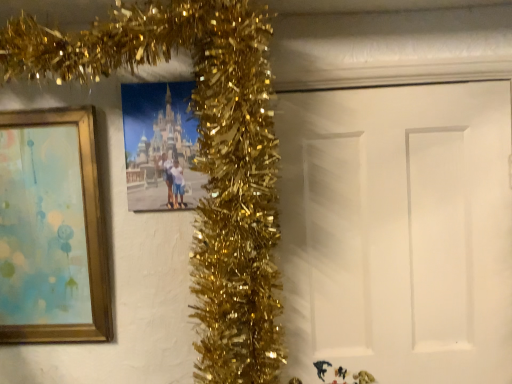
Looking at this image, how much space does matte plastic photo frame at center, positioned as the second picture frame in left-to-right order, occupy vertically?

The height of matte plastic photo frame at center, positioned as the second picture frame in left-to-right order, is 12.64 inches.

This screenshot has width=512, height=384. Describe the element at coordinates (397, 232) in the screenshot. I see `white matte door at center` at that location.

Identify the location of matte plastic photo frame at center, which is the 1th picture frame from right to left. point(159,144).

Considering the positions of points (341, 273) and (150, 137), is point (341, 273) closer to camera compared to point (150, 137)?

No, (341, 273) is behind (150, 137).

In the image, is white matte door at center positioned in front of or behind matte plastic photo frame at center, positioned as the second picture frame in left-to-right order?

white matte door at center is positioned farther from the viewer than matte plastic photo frame at center, positioned as the second picture frame in left-to-right order.

From a real-world perspective, is white matte door at center physically located above or below matte plastic photo frame at center, which is the 1th picture frame from right to left?

Clearly, from a real-world perspective, white matte door at center is below matte plastic photo frame at center, which is the 1th picture frame from right to left.

Is white matte door at center bigger or smaller than matte plastic photo frame at center, which is the 1th picture frame from right to left?

white matte door at center is bigger than matte plastic photo frame at center, which is the 1th picture frame from right to left.

Is matte plastic photo frame at center, which is the 1th picture frame from right to left, situated inside gold wood picture frame at left, the second picture frame from the right, or outside?

matte plastic photo frame at center, which is the 1th picture frame from right to left, is spatially situated outside gold wood picture frame at left, the second picture frame from the right.

Could you tell me if matte plastic photo frame at center, positioned as the second picture frame in left-to-right order, is turned towards gold wood picture frame at left, which is the 1th picture frame from left to right?

No, matte plastic photo frame at center, positioned as the second picture frame in left-to-right order, is not aimed at gold wood picture frame at left, which is the 1th picture frame from left to right.

Between matte plastic photo frame at center, which is the 1th picture frame from right to left, and gold wood picture frame at left, the second picture frame from the right, which one has larger width?

gold wood picture frame at left, the second picture frame from the right.

From the picture: Are matte plastic photo frame at center, positioned as the second picture frame in left-to-right order, and gold wood picture frame at left, the second picture frame from the right, making contact?

No, matte plastic photo frame at center, positioned as the second picture frame in left-to-right order, is not in contact with gold wood picture frame at left, the second picture frame from the right.

Which object is positioned more to the right, matte plastic photo frame at center, positioned as the second picture frame in left-to-right order, or white matte door at center?

white matte door at center.

Is the surface of matte plastic photo frame at center, which is the 1th picture frame from right to left, in direct contact with white matte door at center?

No, matte plastic photo frame at center, which is the 1th picture frame from right to left, is not beside white matte door at center.

Considering the positions of points (128, 154) and (408, 99), is point (128, 154) closer to camera compared to point (408, 99)?

Yes, it is.

Between matte plastic photo frame at center, which is the 1th picture frame from right to left, and white matte door at center, which one has smaller width?

Thinner between the two is white matte door at center.

Which object is further away from the camera taking this photo, white matte door at center or gold wood picture frame at left, which is the 1th picture frame from left to right?

white matte door at center.

Is point (408, 295) closer to viewer compared to point (57, 339)?

Yes, point (408, 295) is in front of point (57, 339).

Does white matte door at center have a greater width compared to gold wood picture frame at left, which is the 1th picture frame from left to right?

No, white matte door at center is not wider than gold wood picture frame at left, which is the 1th picture frame from left to right.

How many degrees apart are the facing directions of white matte door at center and gold wood picture frame at left, the second picture frame from the right?

The facing directions of white matte door at center and gold wood picture frame at left, the second picture frame from the right, are 0.578 degrees apart.

Considering the sizes of objects gold wood picture frame at left, the second picture frame from the right, and white matte door at center in the image provided, who is shorter, gold wood picture frame at left, the second picture frame from the right, or white matte door at center?

gold wood picture frame at left, the second picture frame from the right.

Which of these two, gold wood picture frame at left, which is the 1th picture frame from left to right, or white matte door at center, is smaller?

gold wood picture frame at left, which is the 1th picture frame from left to right, is smaller.

This screenshot has height=384, width=512. What are the coordinates of `picture frame that is the 2nd object located in front of the white matte door at center` in the screenshot? It's located at (52, 230).

Is gold wood picture frame at left, the second picture frame from the right, aimed at white matte door at center?

No.

Looking at this image, are gold wood picture frame at left, which is the 1th picture frame from left to right, and matte plastic photo frame at center, positioned as the second picture frame in left-to-right order, far apart?

They are positioned close to each other.

From a real-world perspective, is gold wood picture frame at left, the second picture frame from the right, physically below matte plastic photo frame at center, positioned as the second picture frame in left-to-right order?

Yes, from a real-world perspective, gold wood picture frame at left, the second picture frame from the right, is under matte plastic photo frame at center, positioned as the second picture frame in left-to-right order.

How far apart are gold wood picture frame at left, the second picture frame from the right, and matte plastic photo frame at center, which is the 1th picture frame from right to left?

A distance of 8.28 inches exists between gold wood picture frame at left, the second picture frame from the right, and matte plastic photo frame at center, which is the 1th picture frame from right to left.

Is gold wood picture frame at left, which is the 1th picture frame from left to right, positioned beyond the bounds of matte plastic photo frame at center, positioned as the second picture frame in left-to-right order?

Absolutely, gold wood picture frame at left, which is the 1th picture frame from left to right, is external to matte plastic photo frame at center, positioned as the second picture frame in left-to-right order.

Starting from the white matte door at center, which picture frame is the 1st one in front? Please provide its 2D coordinates.

[(159, 144)]

Find the location of a particular element. This screenshot has height=384, width=512. picture frame to the right of gold wood picture frame at left, which is the 1th picture frame from left to right is located at coordinates (159, 144).

Looking at the image, which one is located closer to gold wood picture frame at left, which is the 1th picture frame from left to right, matte plastic photo frame at center, which is the 1th picture frame from right to left, or white matte door at center?

Among the two, matte plastic photo frame at center, which is the 1th picture frame from right to left, is located nearer to gold wood picture frame at left, which is the 1th picture frame from left to right.

When comparing their distances from matte plastic photo frame at center, positioned as the second picture frame in left-to-right order, does white matte door at center or gold wood picture frame at left, the second picture frame from the right, seem further?

Based on the image, white matte door at center appears to be further to matte plastic photo frame at center, positioned as the second picture frame in left-to-right order.

Based on their spatial positions, is gold wood picture frame at left, which is the 1th picture frame from left to right, or white matte door at center closer to matte plastic photo frame at center, positioned as the second picture frame in left-to-right order?

Based on the image, gold wood picture frame at left, which is the 1th picture frame from left to right, appears to be nearer to matte plastic photo frame at center, positioned as the second picture frame in left-to-right order.

Looking at this image, from the image, which object appears to be nearer to gold wood picture frame at left, which is the 1th picture frame from left to right, white matte door at center or matte plastic photo frame at center, positioned as the second picture frame in left-to-right order?

matte plastic photo frame at center, positioned as the second picture frame in left-to-right order.

Based on their spatial positions, is matte plastic photo frame at center, which is the 1th picture frame from right to left, or gold wood picture frame at left, which is the 1th picture frame from left to right, closer to white matte door at center?

matte plastic photo frame at center, which is the 1th picture frame from right to left, lies closer to white matte door at center than the other object.

When comparing their distances from white matte door at center, does gold wood picture frame at left, which is the 1th picture frame from left to right, or matte plastic photo frame at center, which is the 1th picture frame from right to left, seem further?

gold wood picture frame at left, which is the 1th picture frame from left to right, is positioned further to the anchor white matte door at center.

Identify the location of picture frame between gold wood picture frame at left, the second picture frame from the right, and white matte door at center from left to right. click(159, 144).